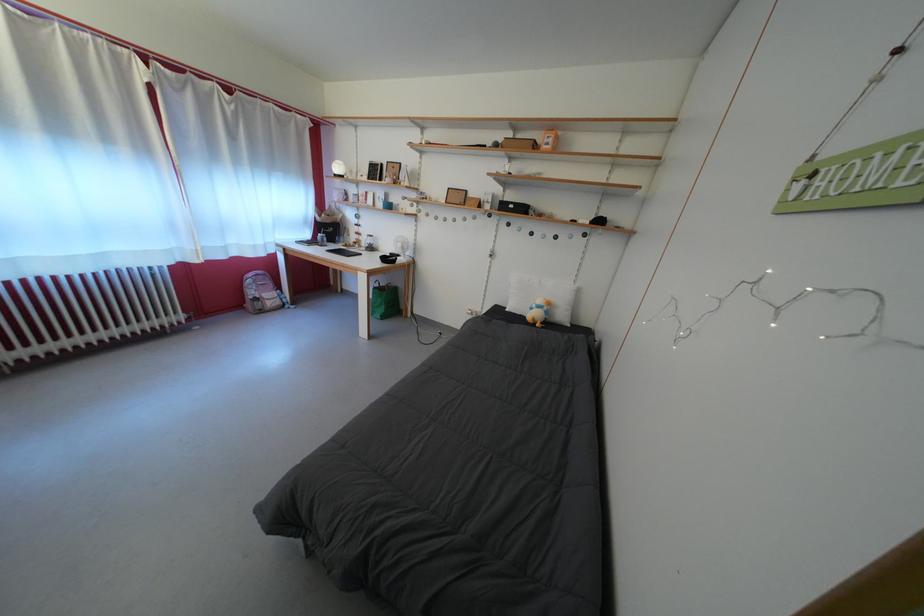
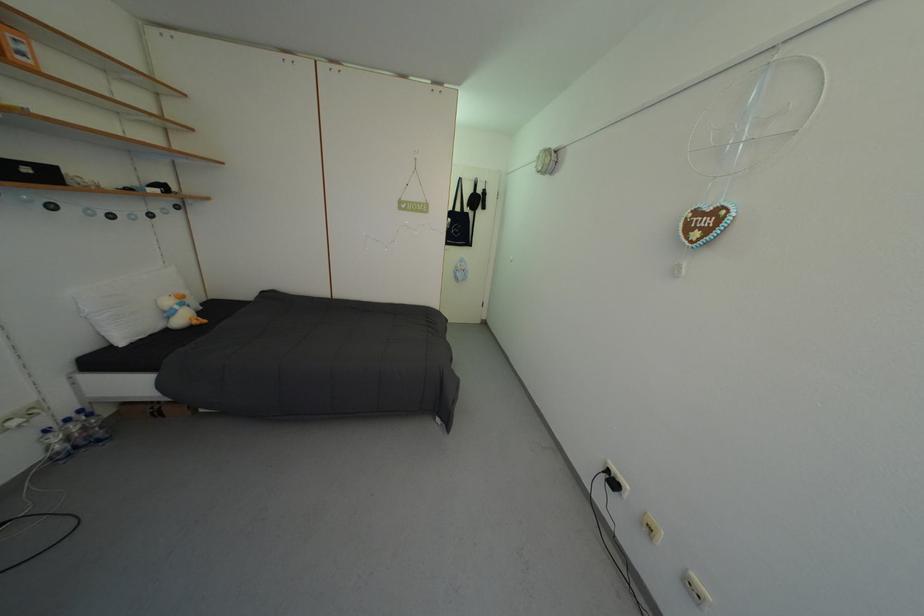
Find the pixel in the second image that matches the point at 557,310 in the first image.

(190, 302)